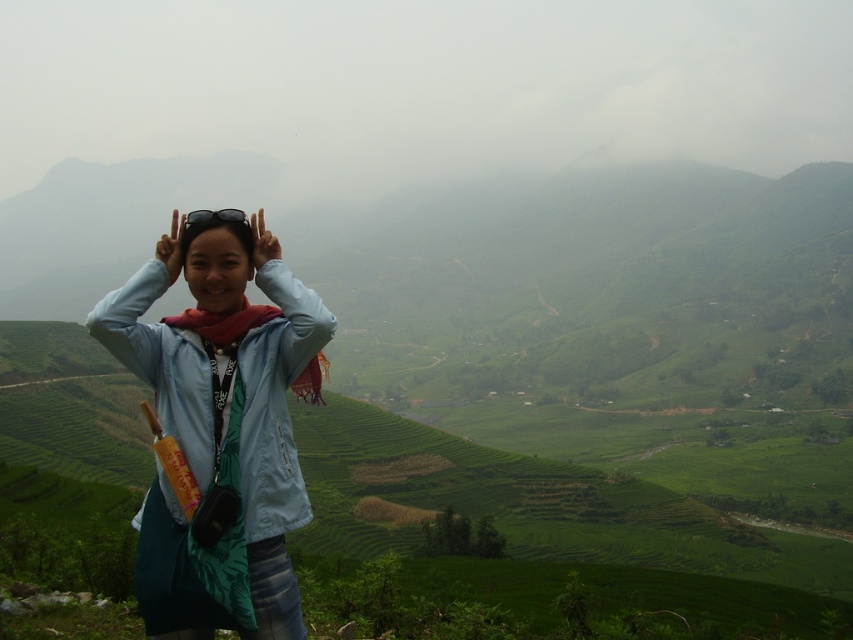
Question: Which point appears farthest from the camera in this image?

Choices:
 (A) (219, 305)
 (B) (183, 256)

Answer: (A)

Question: Which point is farther to the camera?

Choices:
 (A) (280, 588)
 (B) (222, 282)

Answer: (B)

Question: Can you confirm if light blue fabric jacket at center is thinner than matte blue head at center?

Choices:
 (A) no
 (B) yes

Answer: (A)

Question: Which object is closer to the camera taking this photo?

Choices:
 (A) matte blue head at center
 (B) light blue fabric jacket at center

Answer: (B)

Question: Can you confirm if light blue fabric jacket at center is positioned to the right of matte blue head at center?

Choices:
 (A) yes
 (B) no

Answer: (A)

Question: Is light blue fabric jacket at center to the right of matte blue head at center from the viewer's perspective?

Choices:
 (A) no
 (B) yes

Answer: (B)